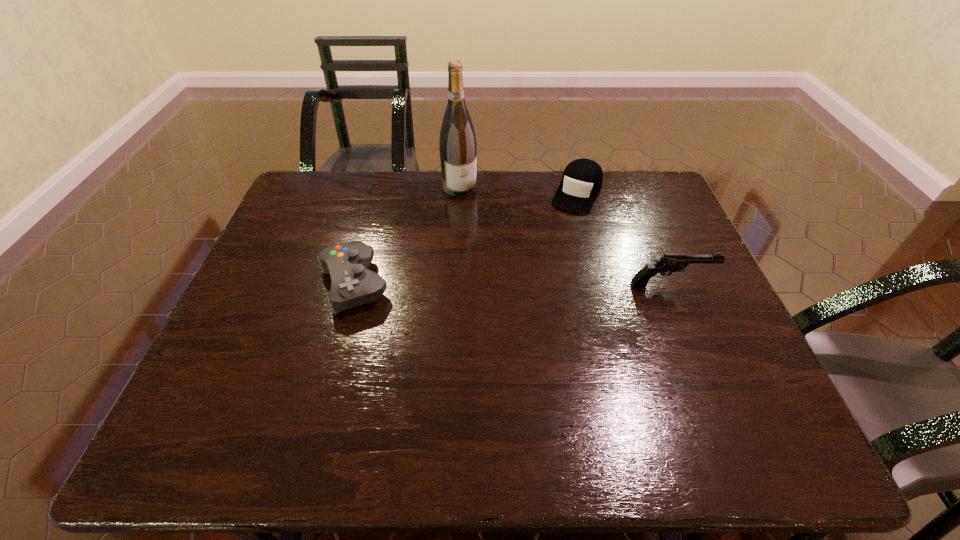
Identify the location of free space between the wine bottle and the gun. (565, 236).

Where is `free space between the gun and the cap`? The image size is (960, 540). free space between the gun and the cap is located at coordinates (624, 239).

Identify the location of vacant area between the control and the gun. The height and width of the screenshot is (540, 960). (513, 284).

Locate an element on the screen. This screenshot has width=960, height=540. free space between the tallest object and the gun is located at coordinates (x=565, y=236).

Find the location of a particular element. free space between the third object from right to left and the gun is located at coordinates (565, 236).

Identify the location of unoccupied area between the tallest object and the cap. (518, 191).

This screenshot has height=540, width=960. What are the coordinates of `free area in between the gun and the tallest object` in the screenshot? It's located at (565, 236).

You are a GUI agent. You are given a task and a screenshot of the screen. Output one action in this format:
    pyautogui.click(x=<x>, y=<y>)
    Task: Click on the vacant space that is in between the control and the cap
    The height and width of the screenshot is (540, 960).
    Given the screenshot: What is the action you would take?
    pyautogui.click(x=466, y=239)

In order to click on free space between the wine bottle and the leftmost object in this screenshot , I will do `click(407, 236)`.

What are the coordinates of `vacant space that is in between the gun and the second object from left to right` in the screenshot? It's located at (565, 236).